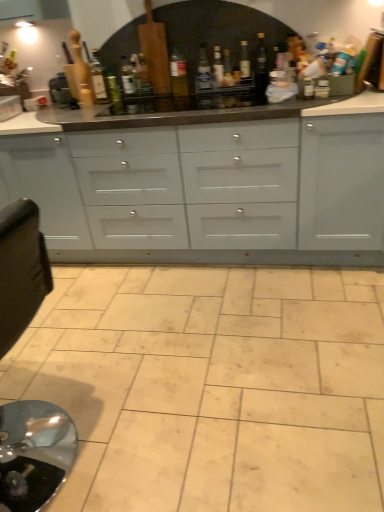
Identify the location of free space to the back side of black leather swivel chair at left. Image resolution: width=384 pixels, height=512 pixels. (96, 358).